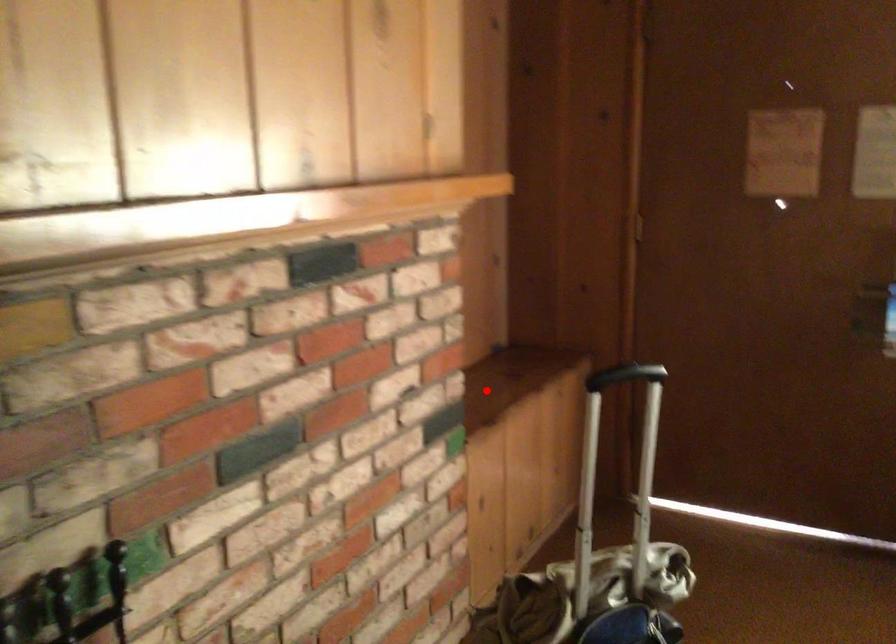
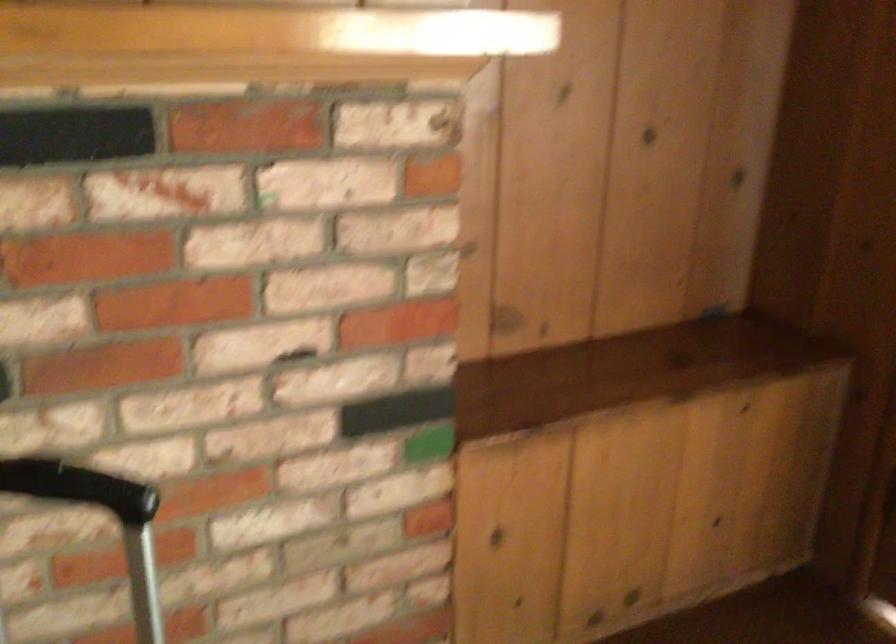
Locate, in the second image, the point that corresponds to the highlighted location in the first image.

(625, 371)